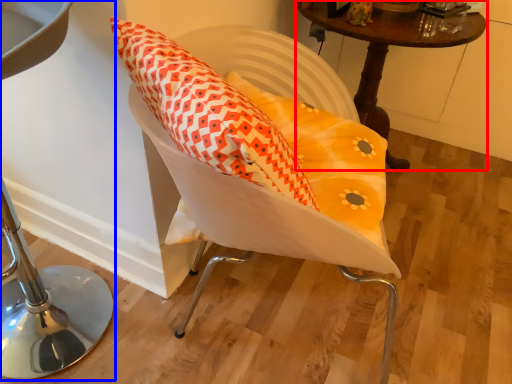
Question: Among these objects, which one is nearest to the camera, table (highlighted by a red box) or furniture (highlighted by a blue box)?

Choices:
 (A) table
 (B) furniture

Answer: (B)